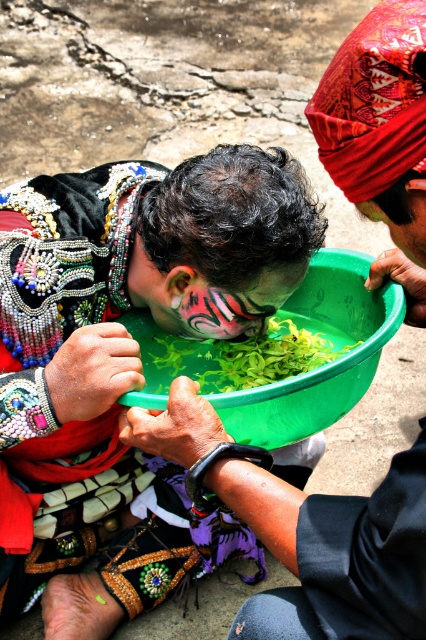
You are an anthropologist observing this cultural ritual. You notice the matte black face paint at center and the matte green bowl at center. Which object is located to the left of the other?

The matte black face paint at center is positioned on the left side of the matte green bowl at center.

You are standing in front of the scene and want to take a photo of the point at coordinates point (235, 160). What is the minimum distance you need to maintain to capture the point clearly?

The minimum distance you need to maintain to capture the point at coordinates point (235, 160) clearly is 1.22 meters, as that is the distance of the point from the camera.

You are an artist observing the scene and want to create a sketch of the individual. Which object, the matte black face paint at center or the matte green bowl at center, should you focus on first if you want to draw the larger object first?

The matte black face paint at center is bigger than the matte green bowl at center, so you should focus on drawing the matte black face paint at center first.